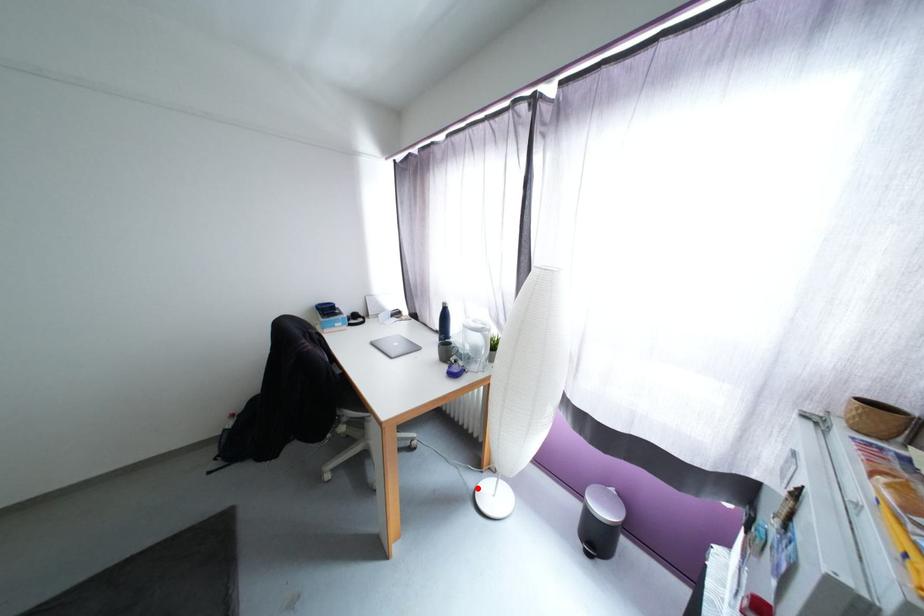
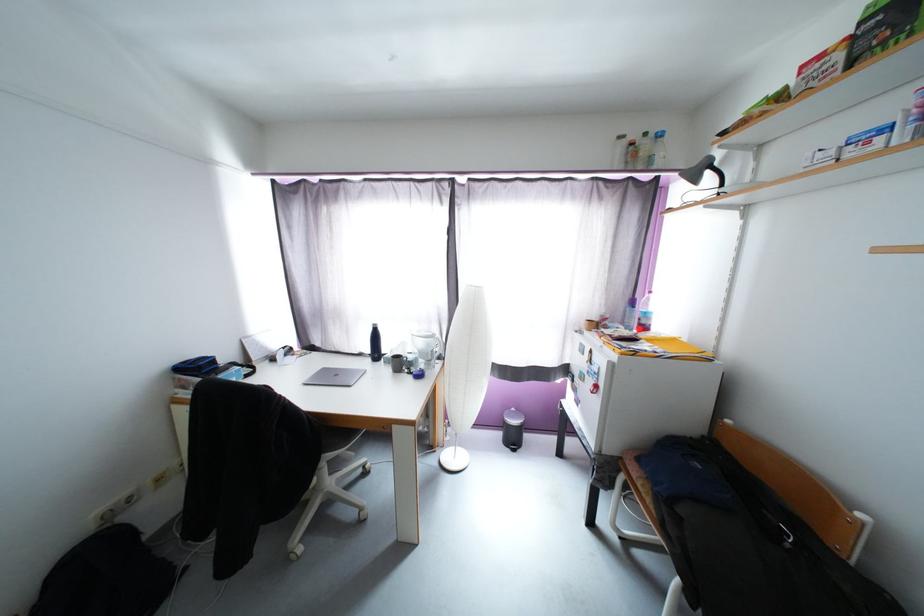
Question: I am providing you with two images of the same scene from different viewpoints. In image1, a red point is highlighted. Considering the same 3D point in image2, which of the following is correct?

Choices:
 (A) It is closer
 (B) It is farther

Answer: (A)